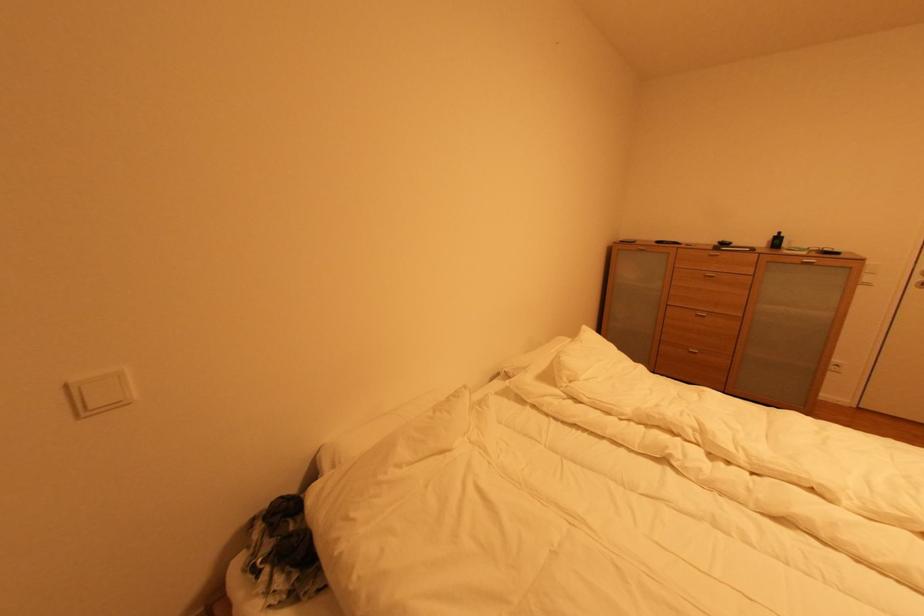
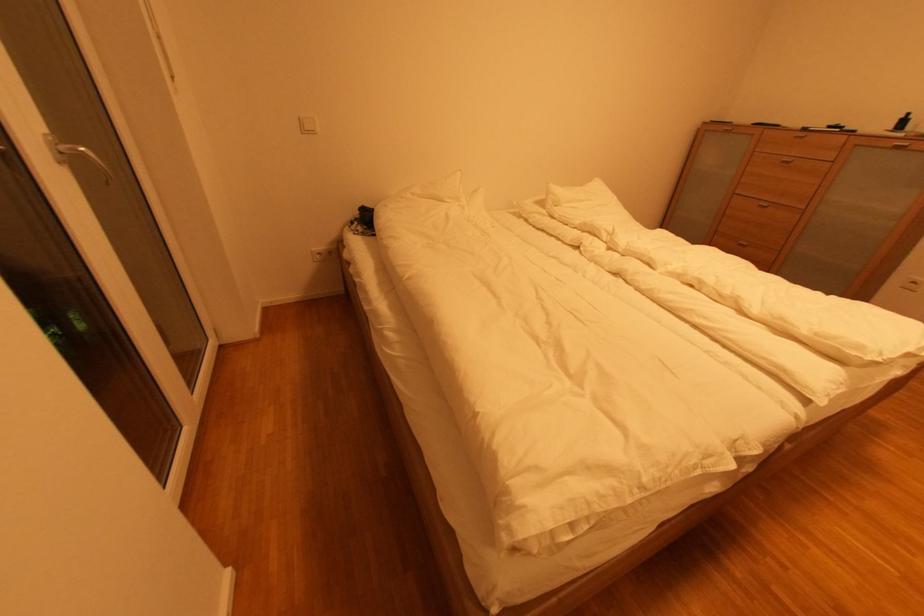
Find the pixel in the second image that matches (x=700, y=354) in the first image.

(749, 246)